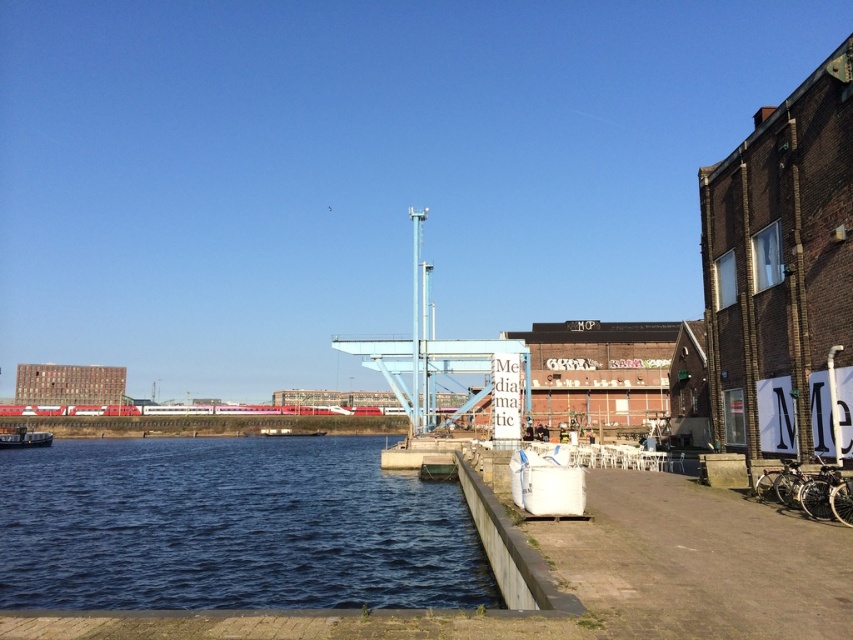
Is blue water at lower left wider than metallic silver boat at lower left?

Yes.

Between point (392, 570) and point (30, 440), which one is positioned behind?

The point (30, 440) is behind.

Is point (352, 548) in front of point (9, 440)?

Yes, it is.

The image size is (853, 640). What are the coordinates of `blue water at lower left` in the screenshot? It's located at (231, 528).